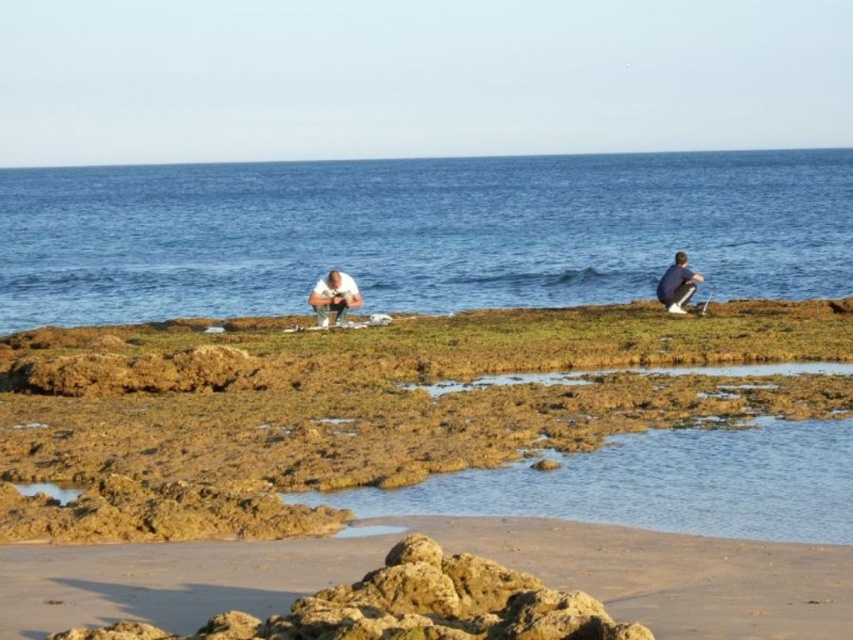
Question: Which point is farther from the camera taking this photo?

Choices:
 (A) (817, 595)
 (B) (9, 172)

Answer: (B)

Question: Which point is closer to the camera?

Choices:
 (A) sandy beach at lower center
 (B) dark blue fabric shirt at right

Answer: (A)

Question: Does blue water at center have a greater width compared to dark blue fabric shirt at right?

Choices:
 (A) no
 (B) yes

Answer: (B)

Question: Which point is farther from the camera taking this photo?

Choices:
 (A) (334, 291)
 (B) (366, 285)
 (C) (686, 262)

Answer: (B)

Question: Observing the image, what is the correct spatial positioning of sandy beach at lower center in reference to dark blue fabric shirt at right?

Choices:
 (A) below
 (B) above

Answer: (A)

Question: Is sandy beach at lower center above light brown leather jacket at center?

Choices:
 (A) no
 (B) yes

Answer: (A)